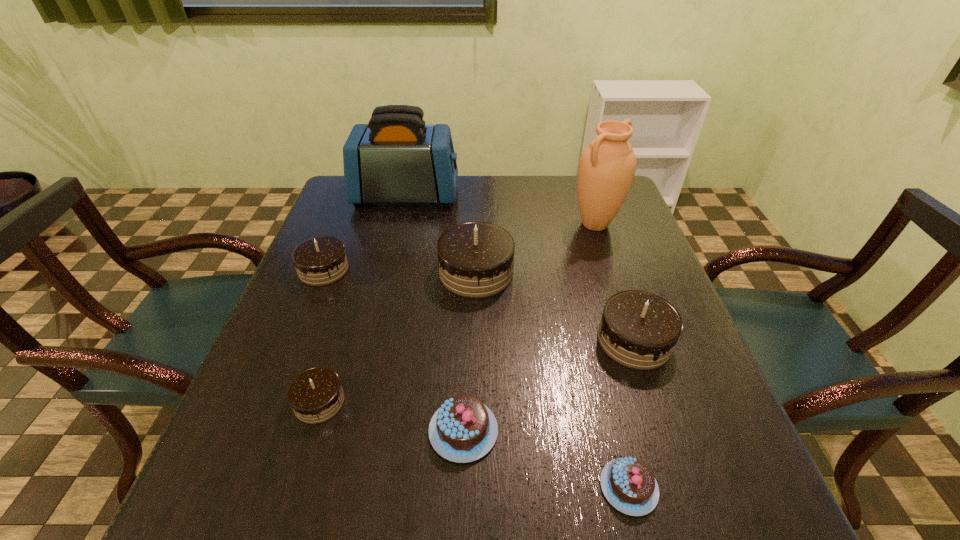
You are a GUI agent. You are given a task and a screenshot of the screen. Output one action in this format:
    pyautogui.click(x=<x>, y=<y>)
    Task: Click on the urn that is at the far edge
    The height and width of the screenshot is (540, 960).
    Given the screenshot: What is the action you would take?
    pyautogui.click(x=607, y=166)

The image size is (960, 540). Find the location of `toaster that is at the far edge`. toaster that is at the far edge is located at coordinates (396, 158).

This screenshot has height=540, width=960. Find the location of `object located at the near edge`. object located at the near edge is located at coordinates (628, 484).

This screenshot has height=540, width=960. What are the coordinates of `toaster present at the left edge` in the screenshot? It's located at (396, 158).

Find the location of a particular element. Image resolution: width=960 pixels, height=540 pixels. urn that is at the right edge is located at coordinates (607, 166).

Locate an element on the screen. The width and height of the screenshot is (960, 540). object present at the far left corner is located at coordinates (396, 158).

You are a GUI agent. You are given a task and a screenshot of the screen. Output one action in this format:
    pyautogui.click(x=<x>, y=<y>)
    Task: Click on the object that is at the far right corner
    
    Given the screenshot: What is the action you would take?
    pyautogui.click(x=607, y=166)

Image resolution: width=960 pixels, height=540 pixels. Find the location of `object that is at the near right corner`. object that is at the near right corner is located at coordinates (628, 484).

The height and width of the screenshot is (540, 960). I want to click on vacant space at the far edge of the desktop, so tap(463, 205).

I want to click on vacant space at the left edge of the desktop, so click(x=310, y=300).